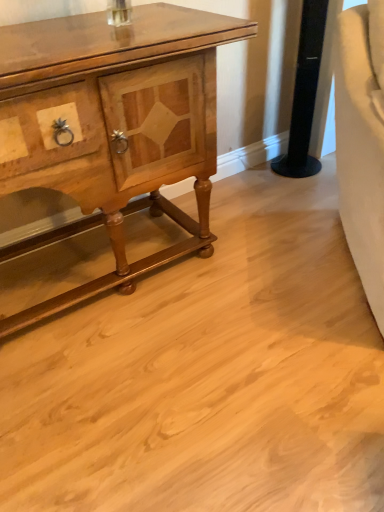
Where is `vacant space in wooden polished cabinet at left (from a real-world perspective)`? Image resolution: width=384 pixels, height=512 pixels. vacant space in wooden polished cabinet at left (from a real-world perspective) is located at coordinates (95, 261).